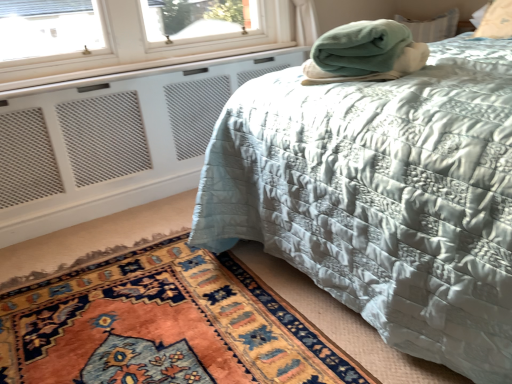
Question: From a real-world perspective, is silky blue quilt at center positioned under carpeted rug at lower left based on gravity?

Choices:
 (A) yes
 (B) no

Answer: (B)

Question: Is silky blue quilt at center smaller than carpeted rug at lower left?

Choices:
 (A) yes
 (B) no

Answer: (B)

Question: Can you confirm if silky blue quilt at center is positioned to the right of carpeted rug at lower left?

Choices:
 (A) no
 (B) yes

Answer: (B)

Question: Is silky blue quilt at center aimed at carpeted rug at lower left?

Choices:
 (A) no
 (B) yes

Answer: (B)

Question: Is the depth of silky blue quilt at center less than that of carpeted rug at lower left?

Choices:
 (A) no
 (B) yes

Answer: (B)

Question: Could carpeted rug at lower left be considered to be inside silky blue quilt at center?

Choices:
 (A) yes
 (B) no

Answer: (B)

Question: Can you confirm if silky blue quilt at center is positioned to the right of white mesh radiator at lower left?

Choices:
 (A) yes
 (B) no

Answer: (A)

Question: Can you confirm if silky blue quilt at center is bigger than white mesh radiator at lower left?

Choices:
 (A) yes
 (B) no

Answer: (A)

Question: Is silky blue quilt at center looking in the opposite direction of white mesh radiator at lower left?

Choices:
 (A) yes
 (B) no

Answer: (B)

Question: Is silky blue quilt at center next to white mesh radiator at lower left and touching it?

Choices:
 (A) no
 (B) yes

Answer: (A)

Question: Can you confirm if silky blue quilt at center is thinner than white mesh radiator at lower left?

Choices:
 (A) yes
 (B) no

Answer: (B)

Question: Is silky blue quilt at center not close to white mesh radiator at lower left?

Choices:
 (A) yes
 (B) no

Answer: (A)

Question: Does green fleece blanket at upper right lie in front of carpeted rug at lower left?

Choices:
 (A) no
 (B) yes

Answer: (A)